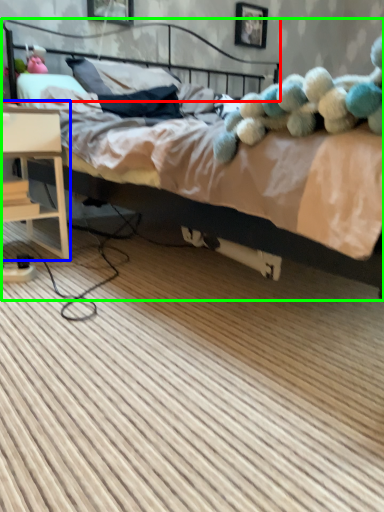
Question: Based on their relative distances, which object is nearer to headboard (highlighted by a red box)? Choose from nightstand (highlighted by a blue box) and bed (highlighted by a green box).

Choices:
 (A) nightstand
 (B) bed

Answer: (B)